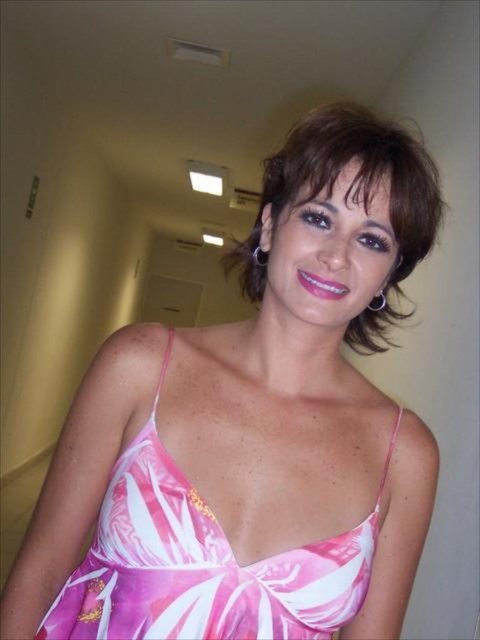
You are a fashion designer observing the scene. You need to determine which object is smaller in size between the pink floral fabric dress at center and the brown smooth hair at center. Which one is it?

The pink floral fabric dress at center has a smaller size compared to the brown smooth hair at center, so the pink floral fabric dress at center is smaller.

You are navigating a hallway and want to move from point A to point B. Point A is at coordinates point (139, 472) and point B is at coordinates point (421, 211). According to the image, which point should you start from to reach the other without backtracking?

You should start from point (421, 211) because point (139, 472) is behind it, so moving from point (421, 211) to point (139, 472) would allow you to reach the destination without backtracking.